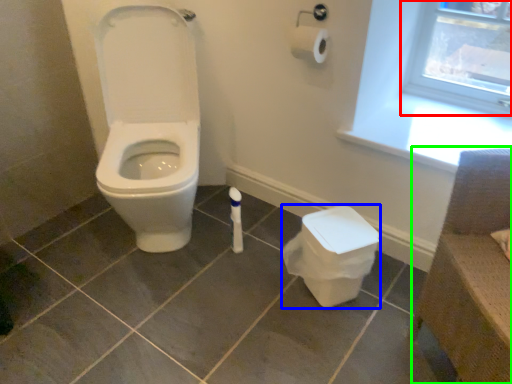
Question: Estimate the real-world distances between objects in this image. Which object is closer to window frame (highlighted by a red box), potty (highlighted by a blue box) or chair (highlighted by a green box)?

Choices:
 (A) potty
 (B) chair

Answer: (A)